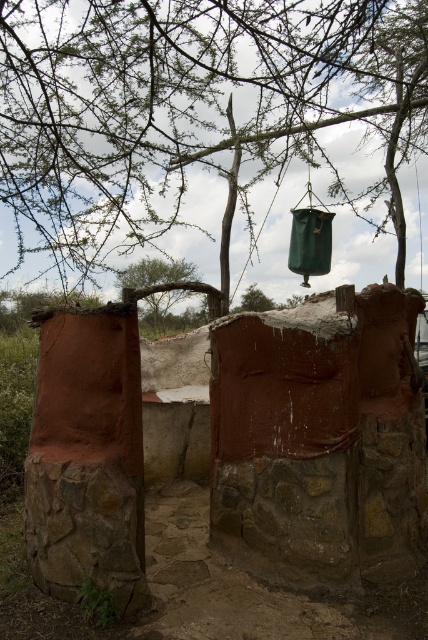
From the picture: You are standing in the outdoor setting under the canopy of leafless branches. You see a green matte hanging pot at upper center. Can you reach it with a 2.5 meter long pole?

The distance between you and the green matte hanging pot at upper center is 2.87 meters, which is longer than the 2.5 meter pole. Therefore, you cannot reach it with the pole.

You are planning to hang a new plant pot in your outdoor area. You have two options based on the image you see. The first is the green matte hanging pot at upper center, and the second is the green leafy tree at center. Which of these two has a wider base to accommodate larger plants?

The green matte hanging pot at upper center has a wider base than the green leafy tree at center, so it can accommodate larger plants better.